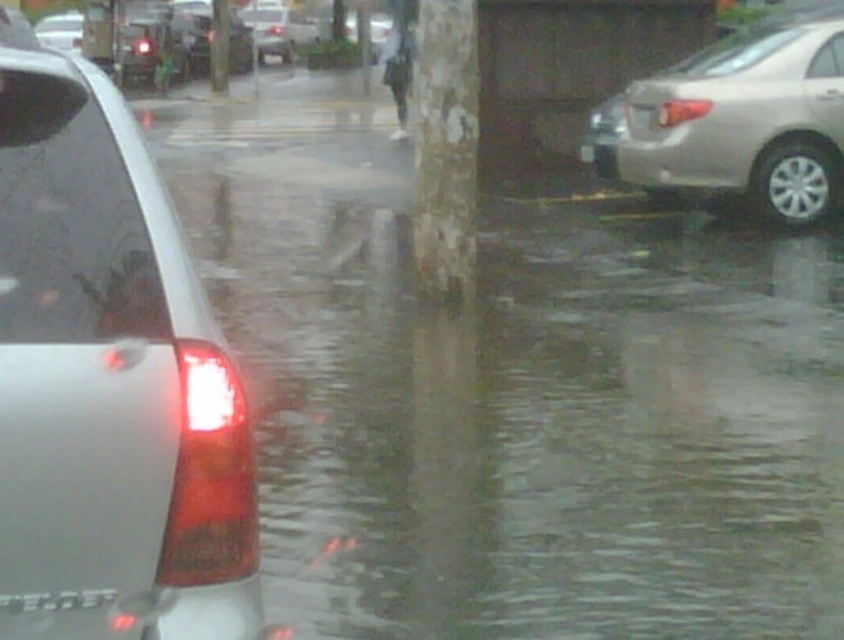
Between point (106, 433) and point (203, 60), which one is positioned in front?

Point (106, 433) is in front.

Is satin silver car at left taller than metallic silver sedan at upper left?

No, satin silver car at left is not taller than metallic silver sedan at upper left.

Image resolution: width=844 pixels, height=640 pixels. Identify the location of satin silver car at left. (109, 381).

Which is above, satin silver car at left or white plastic license plate at center?

Positioned higher is white plastic license plate at center.

Does point (20, 38) come farther from viewer compared to point (647, 113)?

That is True.

The image size is (844, 640). Find the location of `satin silver car at left`. satin silver car at left is located at coordinates (109, 381).

Which is above, satin beige sedan at right or silver metallic sedan at center?

silver metallic sedan at center

Who is taller, satin beige sedan at right or silver metallic sedan at center?

silver metallic sedan at center is taller.

The width and height of the screenshot is (844, 640). What are the coordinates of `satin beige sedan at right` in the screenshot? It's located at (745, 122).

This screenshot has width=844, height=640. What are the coordinates of `satin beige sedan at right` in the screenshot? It's located at (745, 122).